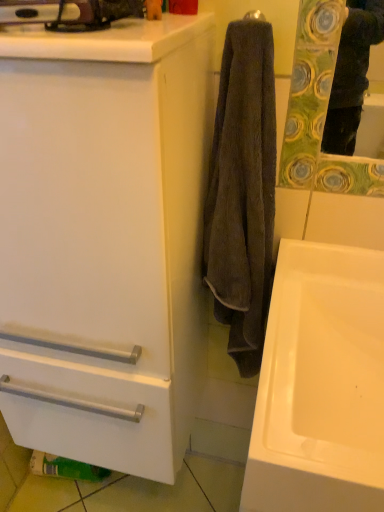
Question: From a real-world perspective, relative to white matte cabinet at center, is dark brown towel at center vertically above or below?

Choices:
 (A) above
 (B) below

Answer: (A)

Question: Which is correct: dark brown towel at center is inside white matte cabinet at center, or outside of it?

Choices:
 (A) outside
 (B) inside

Answer: (A)

Question: Which of these objects is positioned closest to the dark brown towel at center?

Choices:
 (A) white matte cabinet at center
 (B) white glossy sink at lower right

Answer: (B)

Question: Which of these objects is positioned closest to the dark brown towel at center?

Choices:
 (A) white matte cabinet at center
 (B) white glossy sink at lower right

Answer: (B)